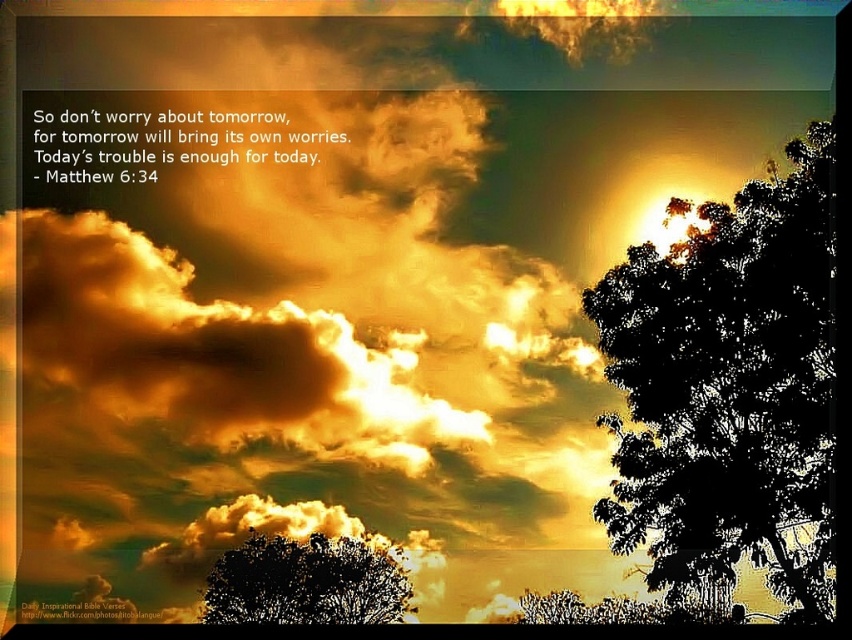
You are an astronomer analyzing the positions of two points in the sky image. The first point is labeled as point [813,225] and the second is point [315,596]. Based on the scene, which point is closer to the observer?

Point [813,225] is in front of point [315,596], so it is closer to the observer.

You are standing in the scene and want to take a photo of the black leafy tree at right. To ensure the tree is in the center of your photo, where should you position your camera? Use the coordinate system where the bottom left corner is the origin point.

The black leafy tree at right is located at coordinate point (729,387). To center it in your photo, position your camera so that the center of the viewfinder aligns with this coordinate point.